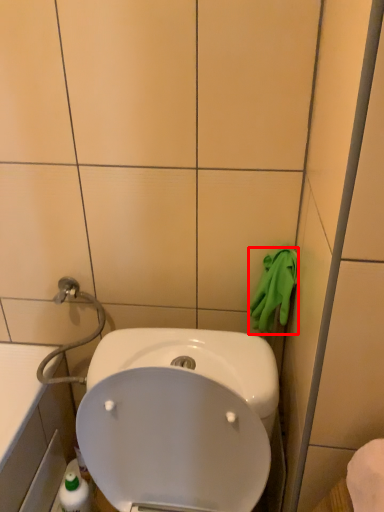
Question: In this image, where is hand towel (annotated by the red box) located relative to glass door?

Choices:
 (A) right
 (B) left

Answer: (B)